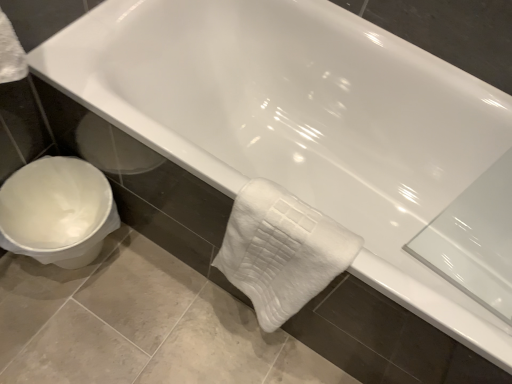
Question: From their relative heights in the image, would you say white plastic toilet at lower left is taller or shorter than white fluffy bath towel at lower center?

Choices:
 (A) short
 (B) tall

Answer: (A)

Question: Is point (47, 218) closer or farther from the camera than point (314, 283)?

Choices:
 (A) farther
 (B) closer

Answer: (A)

Question: In terms of size, does white plastic toilet at lower left appear bigger or smaller than white fluffy bath towel at lower center?

Choices:
 (A) big
 (B) small

Answer: (A)

Question: Is point (278, 258) positioned closer to the camera than point (87, 180)?

Choices:
 (A) closer
 (B) farther

Answer: (A)

Question: From a real-world perspective, is white fluffy bath towel at lower center positioned above or below white plastic toilet at lower left?

Choices:
 (A) below
 (B) above

Answer: (B)

Question: Choose the correct answer: Is white fluffy bath towel at lower center inside white plastic toilet at lower left or outside it?

Choices:
 (A) inside
 (B) outside

Answer: (B)

Question: In the image, is white fluffy bath towel at lower center positioned in front of or behind white plastic toilet at lower left?

Choices:
 (A) front
 (B) behind

Answer: (A)